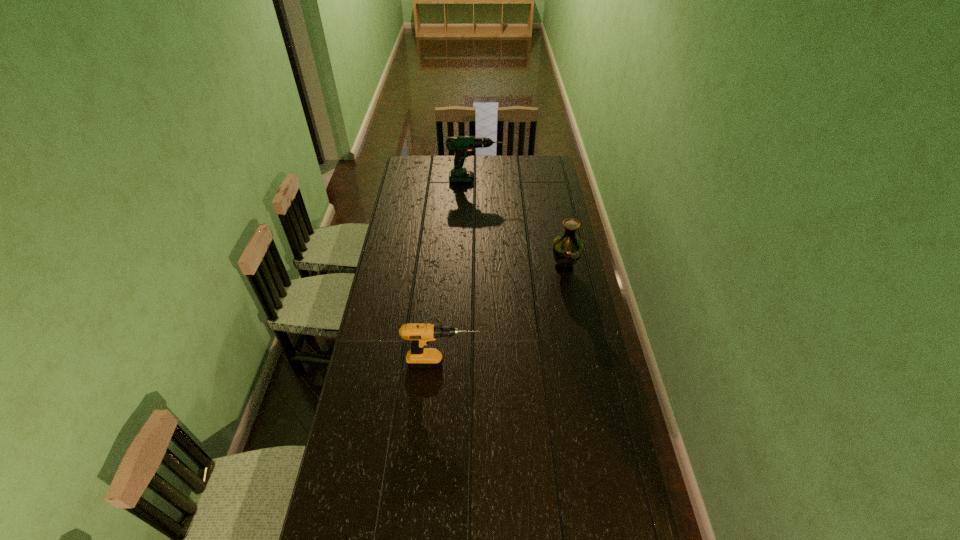
In order to click on the farthest object in this screenshot , I will do `click(462, 145)`.

I want to click on the taller drill, so click(462, 145).

You are a GUI agent. You are given a task and a screenshot of the screen. Output one action in this format:
    pyautogui.click(x=<x>, y=<y>)
    Task: Click on the rightmost object
    
    Given the screenshot: What is the action you would take?
    pyautogui.click(x=567, y=248)

You are a GUI agent. You are given a task and a screenshot of the screen. Output one action in this format:
    pyautogui.click(x=<x>, y=<y>)
    Task: Click on the second nearest object
    
    Given the screenshot: What is the action you would take?
    pyautogui.click(x=567, y=248)

The height and width of the screenshot is (540, 960). I want to click on the shorter drill, so click(420, 334).

Where is `the shortest object`? The height and width of the screenshot is (540, 960). the shortest object is located at coordinates (420, 334).

Locate an element on the screen. This screenshot has height=540, width=960. free space located on the handle side of the farthest object is located at coordinates (529, 180).

At what (x,y) coordinates should I click in order to perform the action: click on vacant region located on the back of the vase. Please return your answer as a coordinate pair (x, y). This screenshot has height=540, width=960. Looking at the image, I should click on (559, 239).

This screenshot has height=540, width=960. Find the location of `vacant space located 0.140m at the tip of the shorter drill`. vacant space located 0.140m at the tip of the shorter drill is located at coordinates (517, 363).

Where is `object located at the right edge`? The width and height of the screenshot is (960, 540). object located at the right edge is located at coordinates (567, 248).